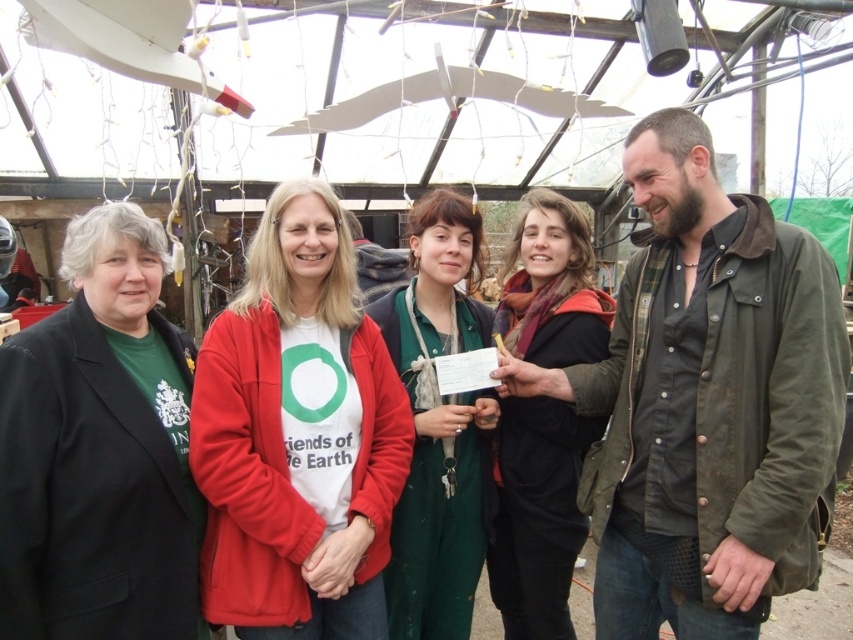
Question: Which of the following is the closest to the observer?

Choices:
 (A) (637, 634)
 (B) (590, 298)
 (C) (440, 400)
 (D) (341, 572)

Answer: (D)

Question: Does olive-green waxed jacket at center-right have a larger size compared to matte red jacket at center?

Choices:
 (A) no
 (B) yes

Answer: (B)

Question: Can you confirm if green matte t-shirt at left is positioned above black matte scarf at center?

Choices:
 (A) yes
 (B) no

Answer: (A)

Question: Among these points, which one is farthest from the camera?

Choices:
 (A) (448, 460)
 (B) (610, 460)
 (C) (252, 611)

Answer: (A)

Question: Is green matte t-shirt at left wider than green matte dress at center?

Choices:
 (A) no
 (B) yes

Answer: (A)

Question: Which point appears closest to the camera in this image?

Choices:
 (A) (560, 529)
 (B) (788, 268)

Answer: (B)